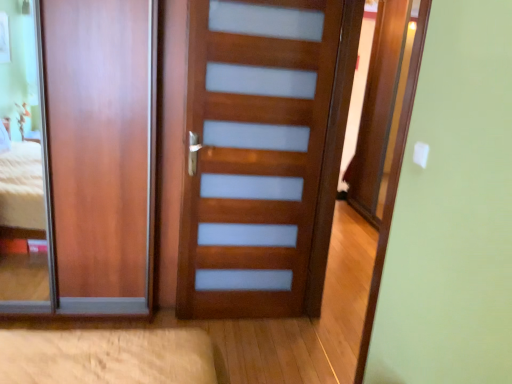
Question: Considering the positions of matte wood door at left, placed as the second door when sorted from right to left, and wooden door at center, which is the second door in left-to-right order, in the image, is matte wood door at left, placed as the second door when sorted from right to left, wider or thinner than wooden door at center, which is the second door in left-to-right order,?

Choices:
 (A) wide
 (B) thin

Answer: (B)

Question: From a real-world perspective, is matte wood door at left, the 1th door in the left-to-right sequence, physically located above or below wooden door at center, which is the second door in left-to-right order?

Choices:
 (A) above
 (B) below

Answer: (B)

Question: Considering the positions of matte wood door at left, placed as the second door when sorted from right to left, and wooden door at center, which is the second door in left-to-right order, in the image, is matte wood door at left, placed as the second door when sorted from right to left, taller or shorter than wooden door at center, which is the second door in left-to-right order,?

Choices:
 (A) tall
 (B) short

Answer: (B)

Question: From a real-world perspective, is wooden door at center, which is the second door in left-to-right order, above or below matte wood door at left, the 1th door in the left-to-right sequence?

Choices:
 (A) above
 (B) below

Answer: (A)

Question: From their relative heights in the image, would you say wooden door at center, which appears as the 1th door when viewed from the right, is taller or shorter than matte wood door at left, placed as the second door when sorted from right to left?

Choices:
 (A) short
 (B) tall

Answer: (B)

Question: Is point (267, 74) positioned closer to the camera than point (74, 0)?

Choices:
 (A) closer
 (B) farther

Answer: (B)

Question: Considering their positions, is wooden door at center, which is the second door in left-to-right order, located in front of or behind matte wood door at left, the 1th door in the left-to-right sequence?

Choices:
 (A) front
 (B) behind

Answer: (A)